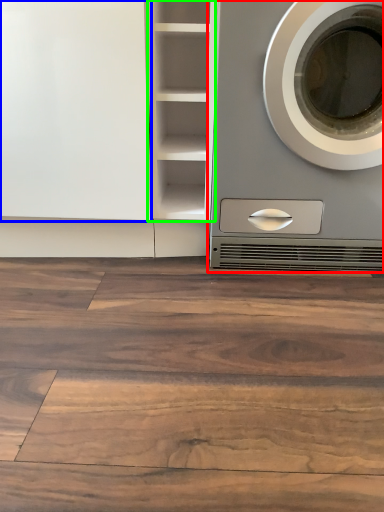
Question: Which object is positioned closest to washing machine (highlighted by a red box)? Select from glass door (highlighted by a blue box) and cabinet (highlighted by a green box).

Choices:
 (A) glass door
 (B) cabinet

Answer: (B)